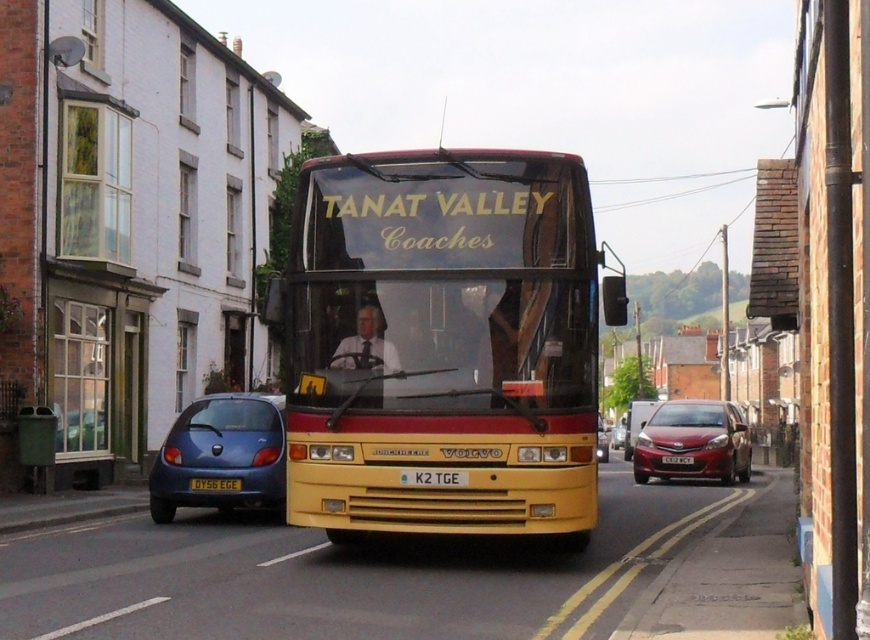
Question: Can you confirm if metallic blue hatchback at lower left is positioned below white plastic license plate at center?

Choices:
 (A) yes
 (B) no

Answer: (B)

Question: In this image, where is yellow matte/decorative bus at center located relative to yellow metallic license plate at center?

Choices:
 (A) below
 (B) above

Answer: (B)

Question: Which object appears closest to the camera in this image?

Choices:
 (A) white plastic license plate at center
 (B) black plastic license plate at center
 (C) yellow metallic license plate at center
 (D) metallic red sedan at center

Answer: (B)

Question: Which point is farther to the camera?

Choices:
 (A) (203, 401)
 (B) (458, 472)
 (C) (614, 436)

Answer: (C)

Question: Is metallic blue hatchback at lower left to the right of black plastic license plate at center from the viewer's perspective?

Choices:
 (A) no
 (B) yes

Answer: (A)

Question: Based on their relative distances, which object is farther from the shiny red sedan at right?

Choices:
 (A) yellow metallic license plate at center
 (B) yellow matte/decorative bus at center
 (C) metallic red sedan at center
 (D) black plastic license plate at center

Answer: (C)